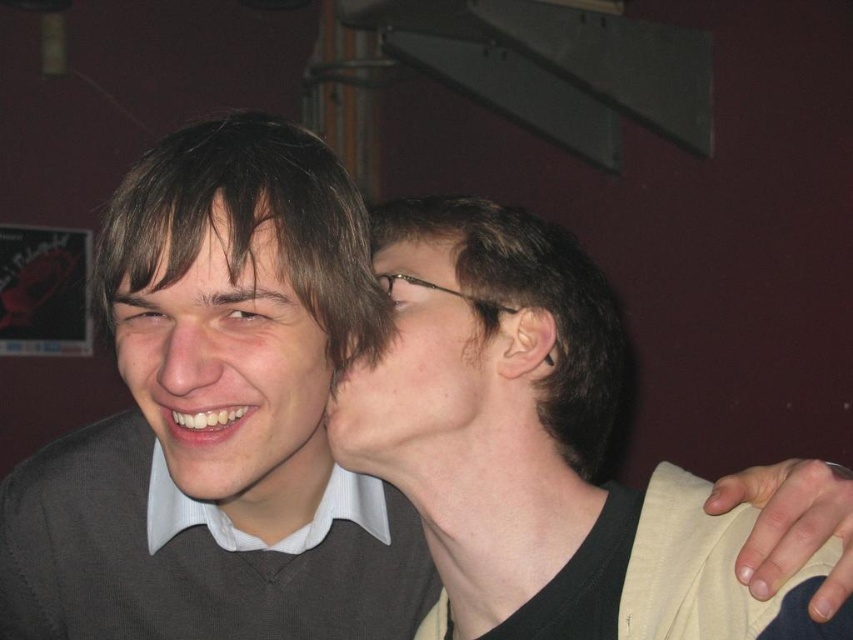
Who is taller, matte black face at left or matte skin at center?

With more height is matte black face at left.

Looking at this image, between matte black face at left and matte skin at center, which one appears on the left side from the viewer's perspective?

matte black face at left

Locate an element on the screen. matte black face at left is located at coordinates (229, 372).

Does matte black hair at center appear over matte skin at center?

Actually, matte black hair at center is below matte skin at center.

Is point (741, 634) positioned after point (344, 396)?

No, it is not.

Is point (729, 636) positioned behind point (334, 442)?

No, (729, 636) is closer to viewer.

You are a GUI agent. You are given a task and a screenshot of the screen. Output one action in this format:
    pyautogui.click(x=<x>, y=<y>)
    Task: Click on the matte black hair at center
    
    Given the screenshot: What is the action you would take?
    pyautogui.click(x=538, y=449)

Which of these two, matte black hair at center or matte black face at left, stands taller?

With more height is matte black hair at center.

Is point (612, 545) positioned in front of point (233, 332)?

No, (612, 545) is behind (233, 332).

Find the location of a particular element. The width and height of the screenshot is (853, 640). matte black hair at center is located at coordinates (538, 449).